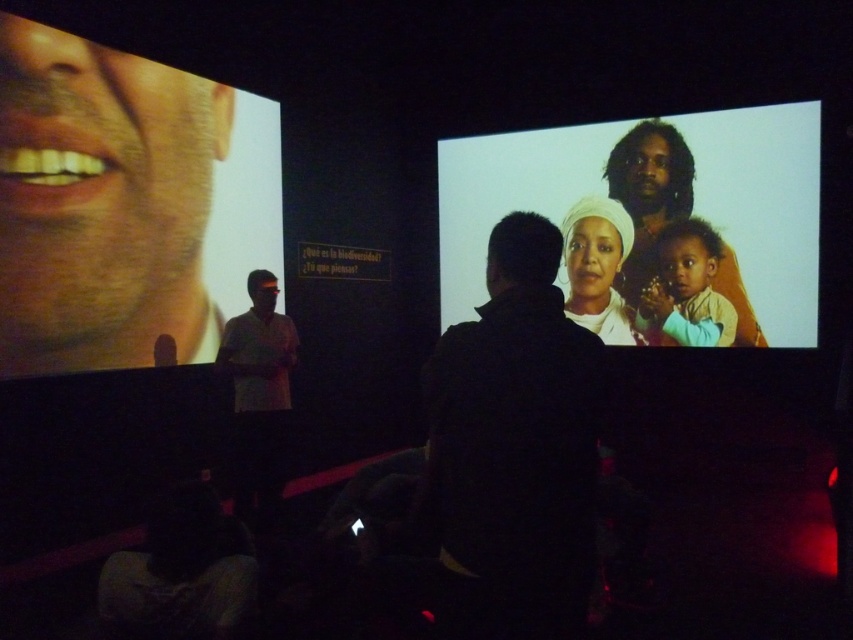
Is point (587, 314) behind point (662, 184)?

That is True.

Is matte white family portrait at upper right above smooth skin woman at upper right?

No.

Who is more forward, (763, 234) or (637, 122)?

Point (763, 234)

Find the location of a particular element. matte white family portrait at upper right is located at coordinates (653, 221).

Is point (737, 280) positioned in front of point (26, 228)?

No, (737, 280) is behind (26, 228).

Who is more distant from viewer, (734, 250) or (10, 76)?

The point (734, 250) is behind.

Is point (593, 164) positioned before point (199, 156)?

No.

At what (x,y) coordinates should I click in order to perform the action: click on matte white family portrait at upper right. Please return your answer as a coordinate pair (x, y). Looking at the image, I should click on (653, 221).

Is smooth skin face at left smaller than smooth skin woman at upper right?

No, smooth skin face at left is not smaller than smooth skin woman at upper right.

Who is positioned more to the left, smooth skin face at left or smooth skin woman at upper right?

Positioned to the left is smooth skin face at left.

Describe the element at coordinates (102, 202) in the screenshot. I see `smooth skin face at left` at that location.

Where is `smooth skin face at left`? smooth skin face at left is located at coordinates (102, 202).